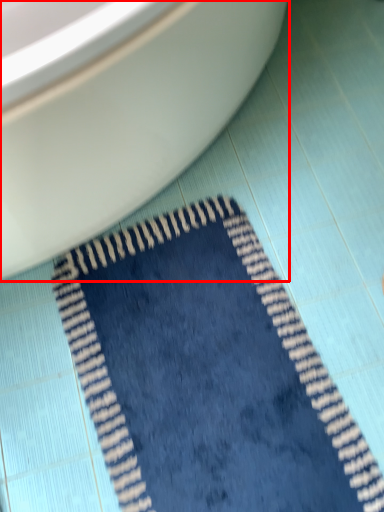
Question: From the image's perspective, considering the relative positions of toilet (annotated by the red box) and doormat in the image provided, where is toilet (annotated by the red box) located with respect to the staircase?

Choices:
 (A) below
 (B) above

Answer: (B)